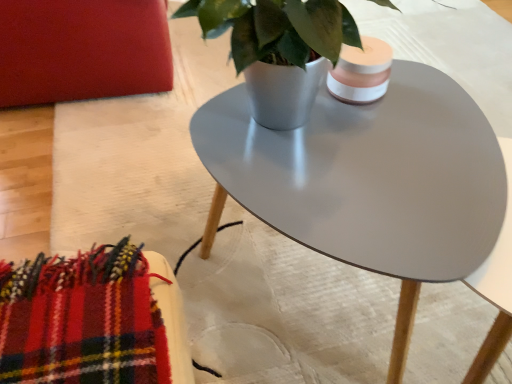
Question: Is matte gray coffee table at center spatially inside matte red armchair at upper left, or outside of it?

Choices:
 (A) outside
 (B) inside

Answer: (A)

Question: From a real-world perspective, is matte gray coffee table at center physically located above or below matte red armchair at upper left?

Choices:
 (A) below
 (B) above

Answer: (B)

Question: Considering the real-world distances, which object is closest to the matte gray pot at center?

Choices:
 (A) matte red armchair at upper left
 (B) matte gray coffee table at center

Answer: (B)

Question: Based on their relative distances, which object is nearer to the matte gray coffee table at center?

Choices:
 (A) matte gray pot at center
 (B) matte red armchair at upper left

Answer: (A)